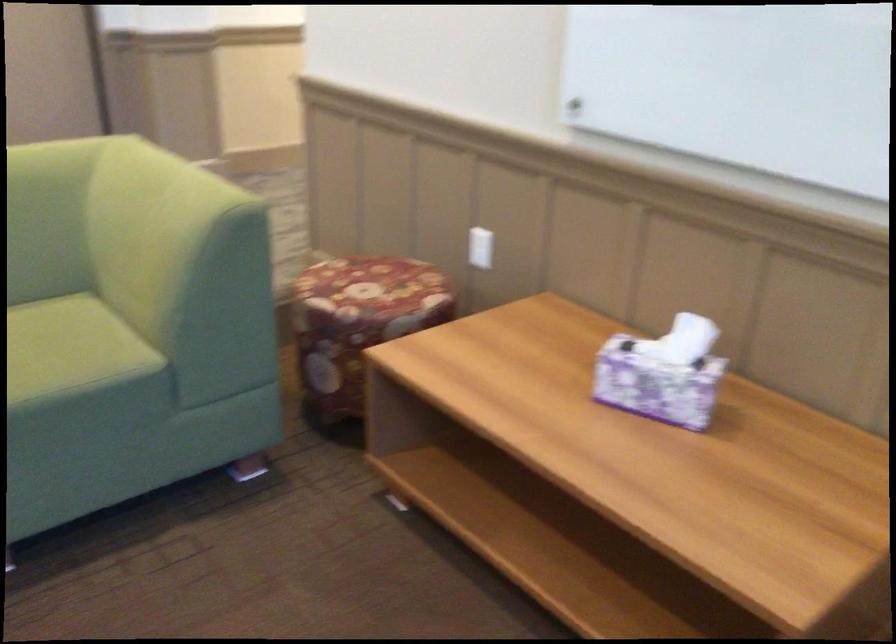
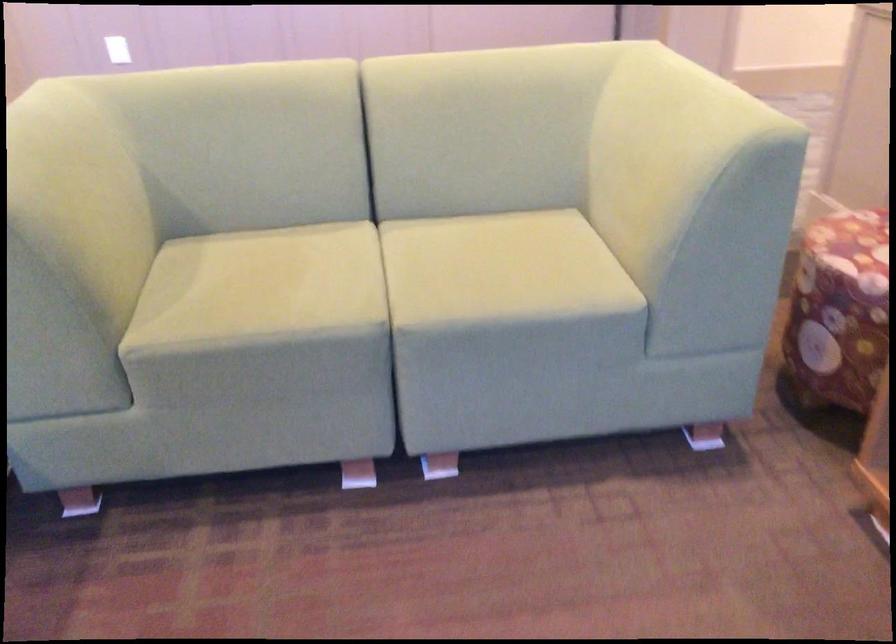
Question: The images are taken continuously from a first-person perspective. In which direction is your viewpoint rotating?

Choices:
 (A) Left
 (B) Right
 (C) Up
 (D) Down

Answer: (A)